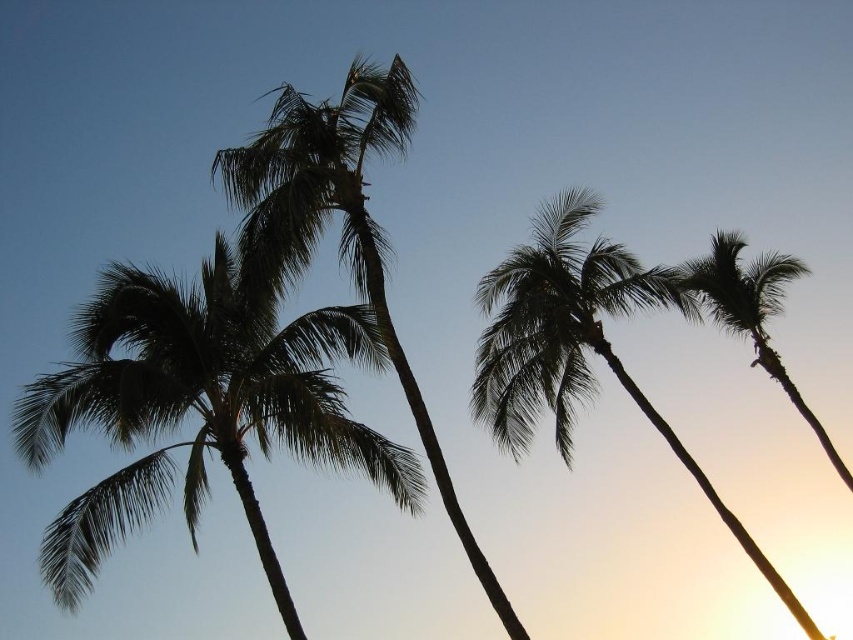
You are standing in a tropical garden and want to take a photo of the silhouette leafy palm at upper center. If you are currently 50 feet away from it, how much closer do you need to move to capture the palm in your camera frame?

The silhouette leafy palm at upper center is 57.97 feet away from the camera. To capture it in your camera frame, you need to move 7.97 feet closer to reduce the distance from 57.97 feet to 50 feet.

You are a bird flying over the tropical scene. You see the silhouette leafy palm at left and the silhouette leafy palm at right. Which palm tree is positioned lower in the image?

The silhouette leafy palm at left is positioned lower than the silhouette leafy palm at right.

You are a photographer trying to capture the sunset with both the silhouette leafy palm at left and the silhouette leafy palm at right in your frame. Which palm tree should you move closer to if you want both trees to appear equally sized in your photo?

To make both the silhouette leafy palm at left and the silhouette leafy palm at right appear equally sized in your photo, you should move closer to the silhouette leafy palm at left since it is smaller than the one on the right. By moving closer to the smaller palm, you can balance their apparent sizes in the frame.